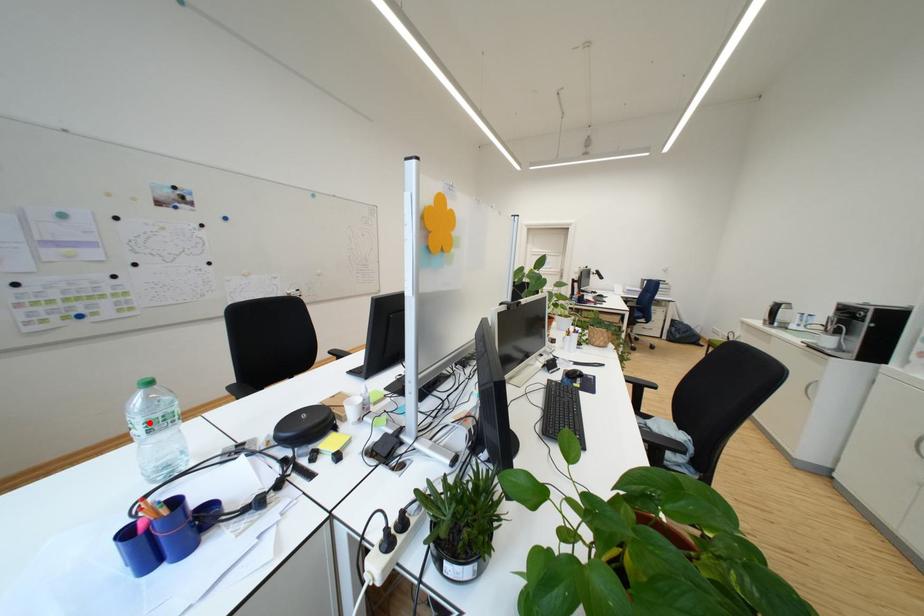
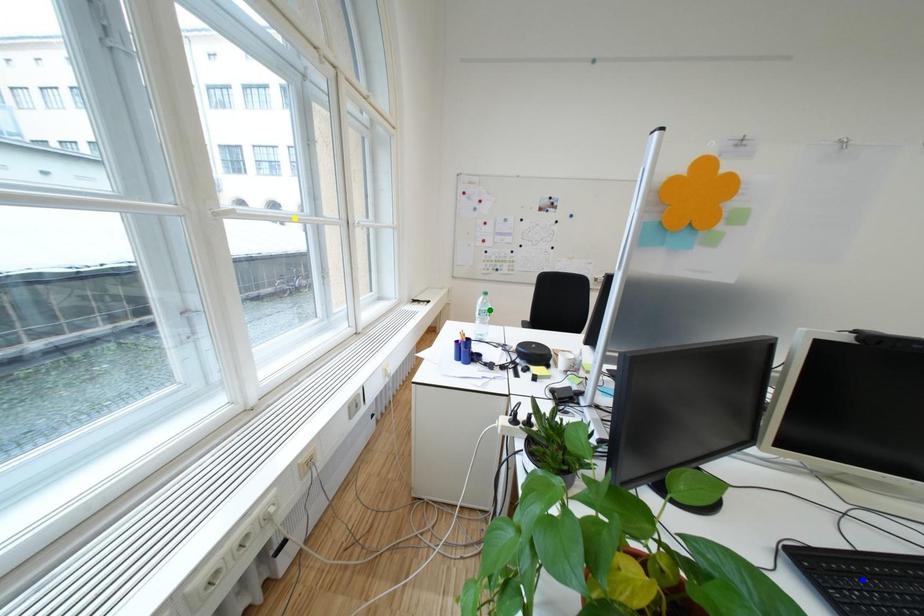
Question: I am providing you with two images of the same scene from different viewpoints. A red point is marked on the first image. You are given multiple points on the second image. Which spot in image 2 lines up with the point in image 1?

Choices:
 (A) blue point
 (B) yellow point
 (C) green point

Answer: (C)